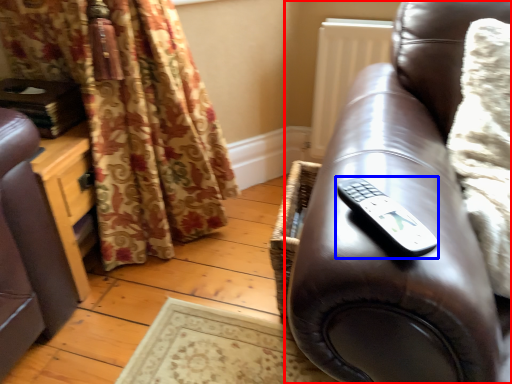
Question: Which of the following is the closest to the observer, studio couch (highlighted by a red box) or remote (highlighted by a blue box)?

Choices:
 (A) studio couch
 (B) remote

Answer: (A)